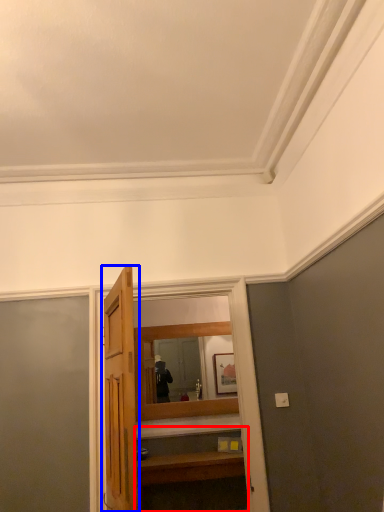
Question: Which point is further to the camera, vanity (highlighted by a red box) or door (highlighted by a blue box)?

Choices:
 (A) vanity
 (B) door

Answer: (A)